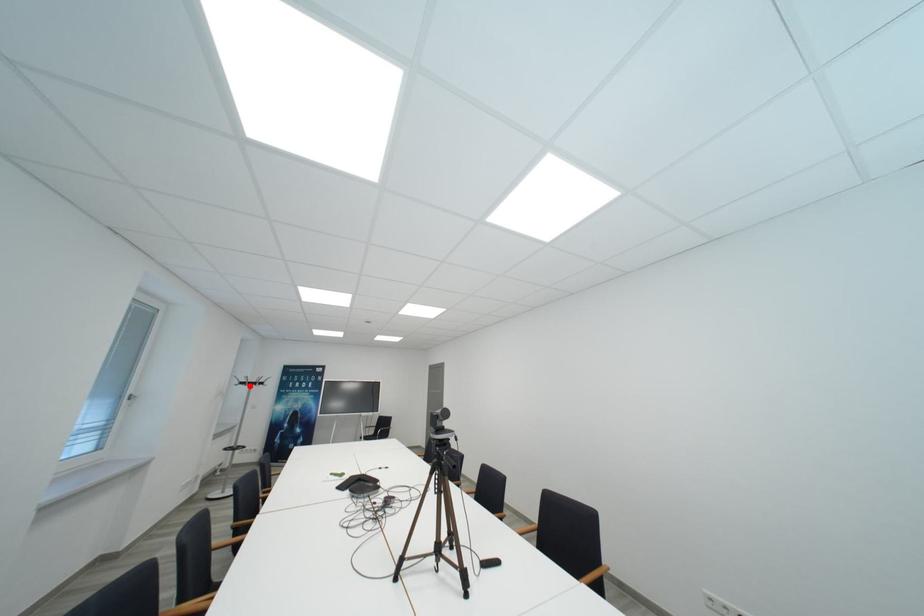
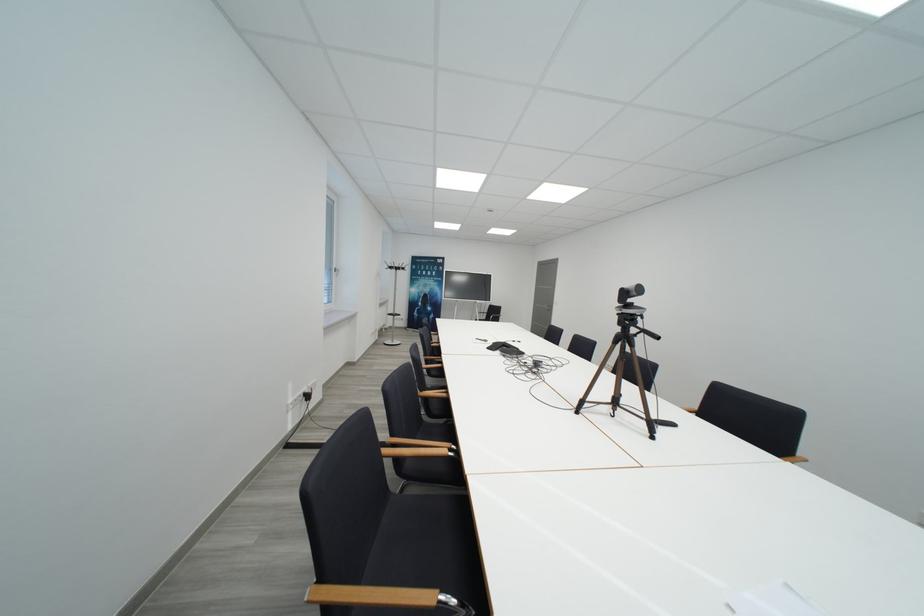
Question: I am providing you with two images of the same scene from different viewpoints. A red point is shown in image1. For the corresponding object point in image2, is it positioned nearer or farther from the camera?

Choices:
 (A) Nearer
 (B) Farther

Answer: (A)